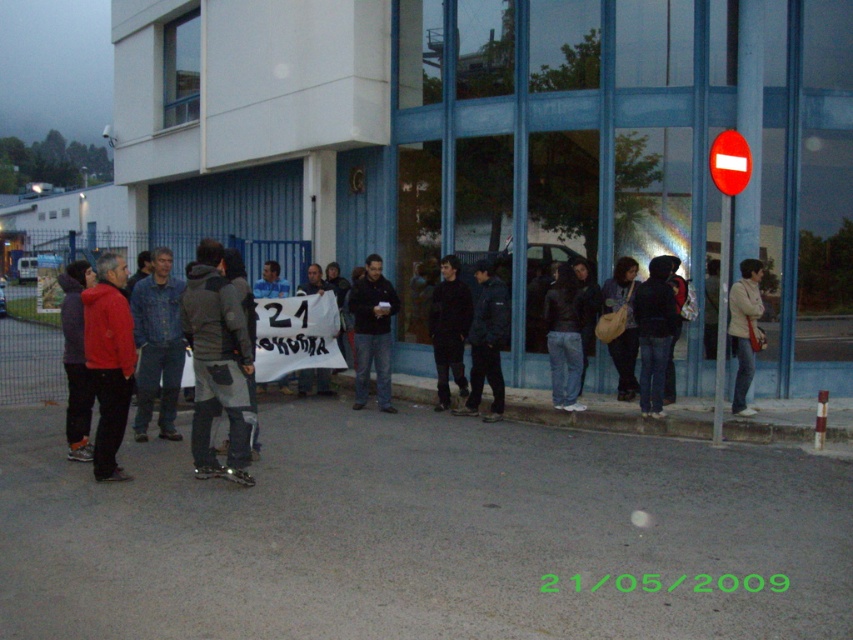
Question: Does black matte jacket at center have a lesser width compared to light beige jacket at center?

Choices:
 (A) no
 (B) yes

Answer: (A)

Question: Is matte red jacket at left behind dark blue jacket at center?

Choices:
 (A) no
 (B) yes

Answer: (A)

Question: Which of the following is the farthest from the observer?

Choices:
 (A) (747, 330)
 (B) (363, 321)

Answer: (B)

Question: Which object appears farthest from the camera in this image?

Choices:
 (A) dark blue jacket at center
 (B) light beige jacket at center
 (C) matte red jacket at left
 (D) black matte jacket at center

Answer: (D)

Question: Which object is the farthest from the black matte jacket at center?

Choices:
 (A) light beige jacket at center
 (B) dark blue jacket at center

Answer: (A)

Question: Does dark blue jeans at center have a larger size compared to dark blue jacket at center?

Choices:
 (A) yes
 (B) no

Answer: (A)